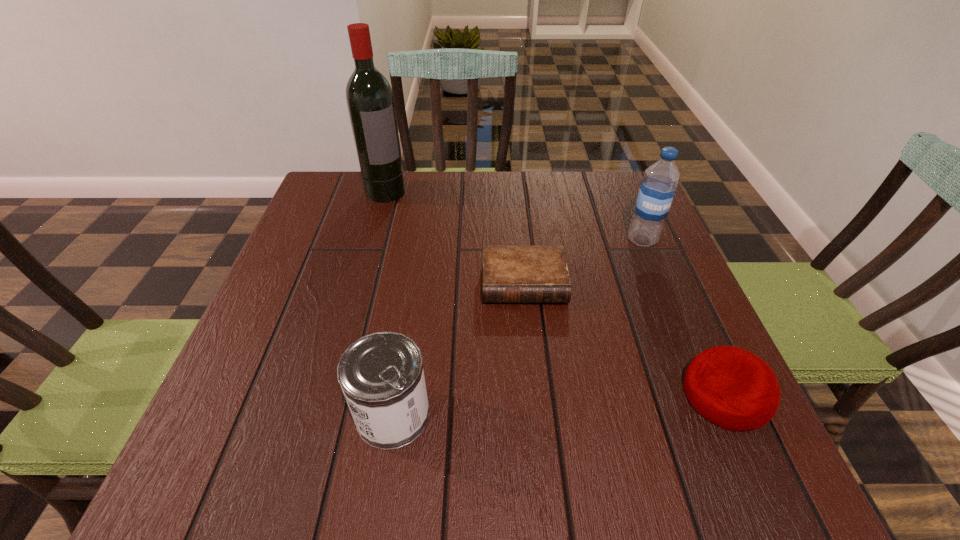
At what (x,y) coordinates should I click in order to perform the action: click on vacant area in the image that satisfies the following two spatial constraints: 1. on the front side of the shortest object; 2. on the seat area of the second shortest object. Please return your answer as a coordinate pair (x, y). Looking at the image, I should click on (535, 395).

I want to click on free spot that satisfies the following two spatial constraints: 1. on the back side of the third shortest object; 2. on the seat area of the fourth tallest object, so point(396,395).